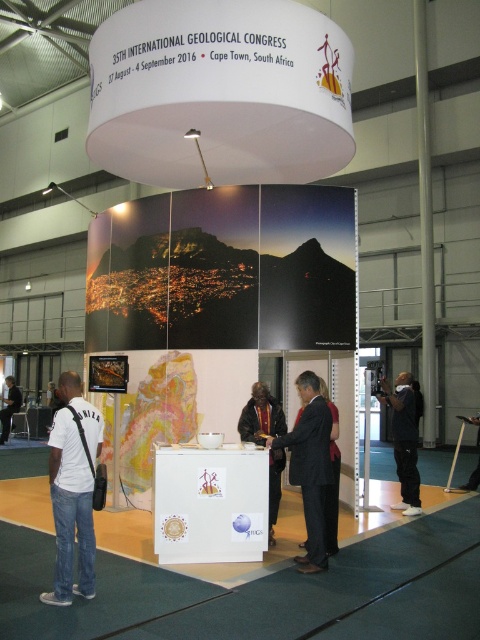
Question: Which object is the farthest from the velvet-like brown coat at center?

Choices:
 (A) white cotton shirt at lower left
 (B) dark suit at center

Answer: (A)

Question: Can you confirm if dark suit at center is wider than black fabric at right?

Choices:
 (A) no
 (B) yes

Answer: (B)

Question: Does dark suit at center have a larger size compared to white fabric bag at lower left?

Choices:
 (A) yes
 (B) no

Answer: (A)

Question: Which of the following is the farthest from the observer?

Choices:
 (A) white cotton shirt at lower left
 (B) white fabric bag at lower left

Answer: (B)

Question: Is velvet-like brown coat at center positioned in front of white fabric bag at lower left?

Choices:
 (A) yes
 (B) no

Answer: (A)

Question: Which object is positioned closest to the white fabric bag at lower left?

Choices:
 (A) black fabric at right
 (B) velvet-like brown coat at center
 (C) dark suit at center
 (D) white cotton shirt at lower left

Answer: (B)